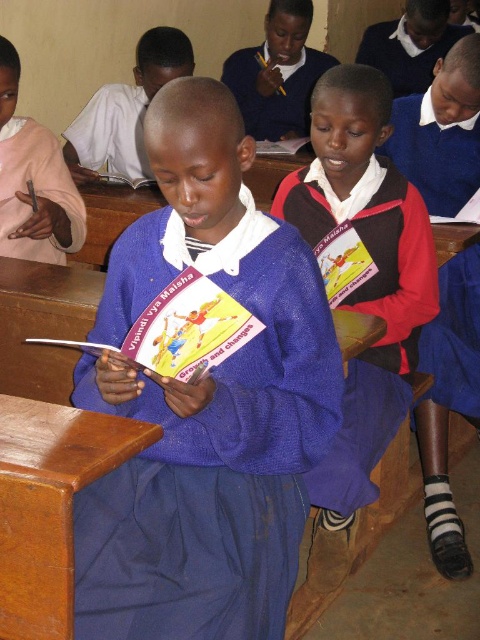
Question: Does matte blue sweater at center come in front of blue uniform shirt at center?

Choices:
 (A) yes
 (B) no

Answer: (A)

Question: Which object appears closest to the camera in this image?

Choices:
 (A) blue knitted sweater at center
 (B) blue uniform shirt at center
 (C) matte blue sweater at center
 (D) blue sweater at center

Answer: (A)

Question: Does matte blue sweater at center appear on the right side of brown wood table at lower left?

Choices:
 (A) no
 (B) yes

Answer: (B)

Question: Which object is closer to the camera taking this photo?

Choices:
 (A) matte blue sweater at center
 (B) blue sweater at center
 (C) brown wood table at lower left
 (D) blue uniform shirt at center

Answer: (C)

Question: Which is nearer to the blue knitted sweater at center?

Choices:
 (A) blue sweater at center
 (B) blue uniform shirt at center
 (C) brown wood table at lower left
 (D) matte blue sweater at center

Answer: (C)

Question: Is blue knitted sweater at center positioned in front of blue sweater at center?

Choices:
 (A) yes
 (B) no

Answer: (A)